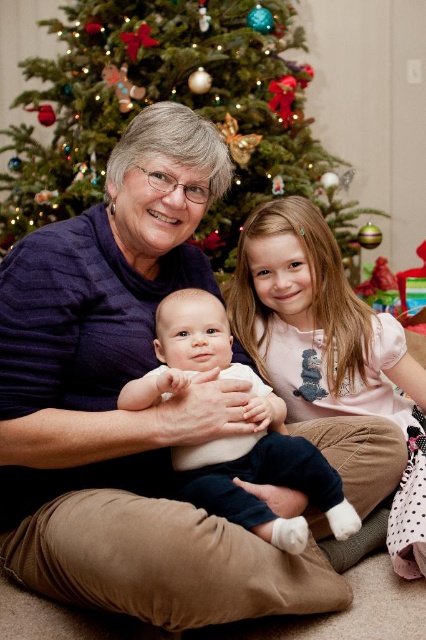
Question: Based on their relative distances, which object is nearer to the pink satin dress at center?

Choices:
 (A) green textured christmas tree at upper center
 (B) white soft fabric baby at center

Answer: (B)

Question: Does pink satin dress at center have a greater width compared to white soft fabric baby at center?

Choices:
 (A) yes
 (B) no

Answer: (A)

Question: Does green textured christmas tree at upper center have a larger size compared to white soft fabric baby at center?

Choices:
 (A) no
 (B) yes

Answer: (B)

Question: Is pink satin dress at center thinner than white soft fabric baby at center?

Choices:
 (A) yes
 (B) no

Answer: (B)

Question: Which point appears closest to the camera in this image?

Choices:
 (A) (345, 304)
 (B) (227, 460)
 (C) (170, 29)

Answer: (B)

Question: Which object is farther from the camera taking this photo?

Choices:
 (A) white soft fabric baby at center
 (B) green textured christmas tree at upper center
 (C) pink satin dress at center

Answer: (B)